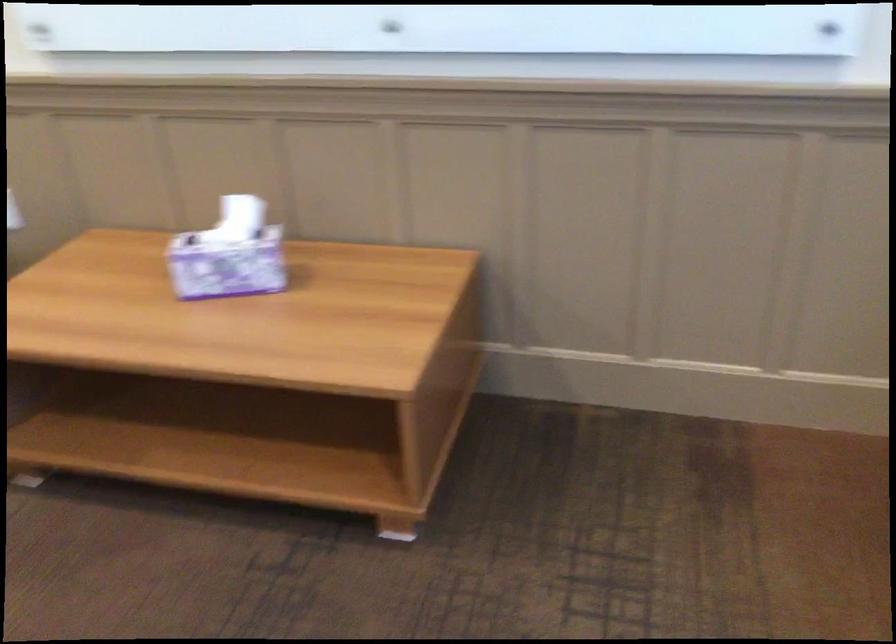
Describe the element at coordinates (239, 218) in the screenshot. I see `the white tissue paper` at that location.